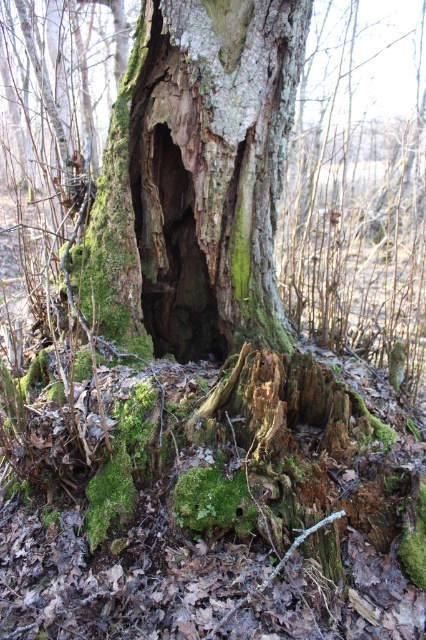
You are a squirrel trying to find a safe spot to store acorns. You see the green mossy bark at center. Based on its position, can you estimate where exactly it is located on the tree trunk?

The green mossy bark at center is located at the coordinates point [198,176] on the tree trunk.

You are a hiker who wants to place a small backpack between the green mossy bark at center and the green mossy tree trunk at center. Which object should you place it closer to in order to have it visible from your current position?

You should place the backpack closer to the green mossy bark at center because it is in front of the green mossy tree trunk at center, making it more visible from your current position.

You are a biologist observing the tree in the forest. You notice two areas with green mossy growths. The first is the green mossy bark at center, and the second is the green mossy tree trunk at center. Which of these two mossy areas is positioned lower on the tree?

The green mossy bark at center is located below the green mossy tree trunk at center, so the green mossy bark at center is positioned lower on the tree.